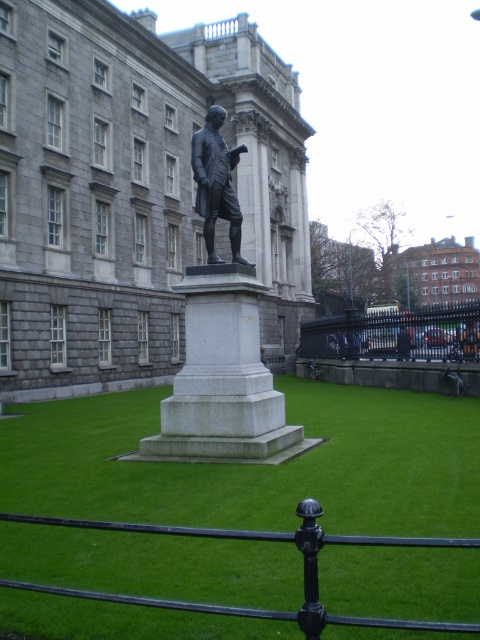
You are standing at the point marked as point (222,340). Which object are you standing on?

You are standing on the polished bronze statue at center because the point (222,340) is located on it.

You are standing in front of the statue and want to take a photo that includes both the polished bronze statue at center and the white marble pedestal at center. If you position yourself to the right of the pedestal, will the statue appear to your left or right in the photo?

The polished bronze statue at center is to the left of the white marble pedestal at center. If you stand to the right of the pedestal, the statue will appear to your left in the photo.

You are a groundskeeper who needs to mow the lawn. You see the green grass at center and the white marble pedestal at center. Which area should you avoid mowing to prevent damaging the pedestal?

You should avoid mowing the area near the white marble pedestal at center because the green grass at center is in front of it, meaning the pedestal is behind the grass and closer to you. Mowing too close could risk damaging the pedestal.